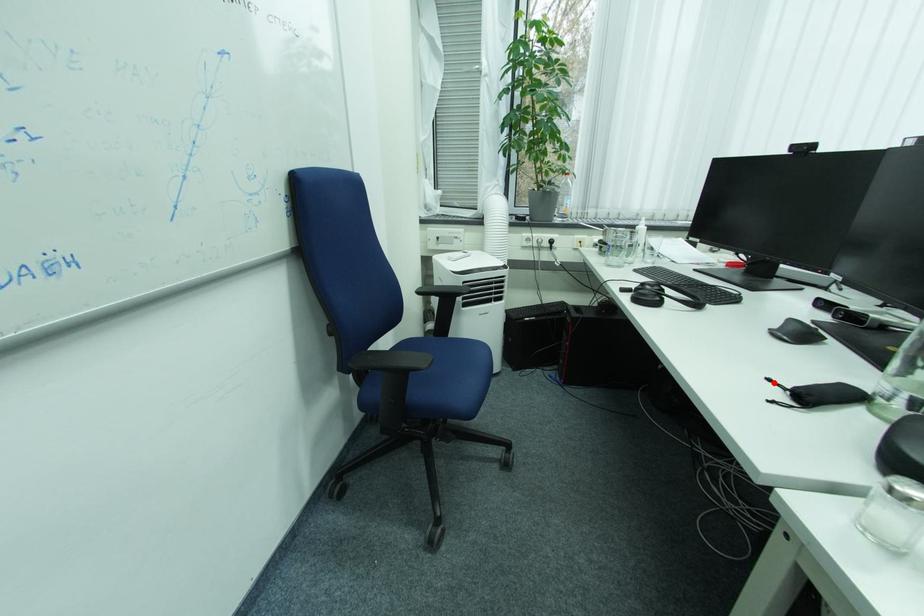
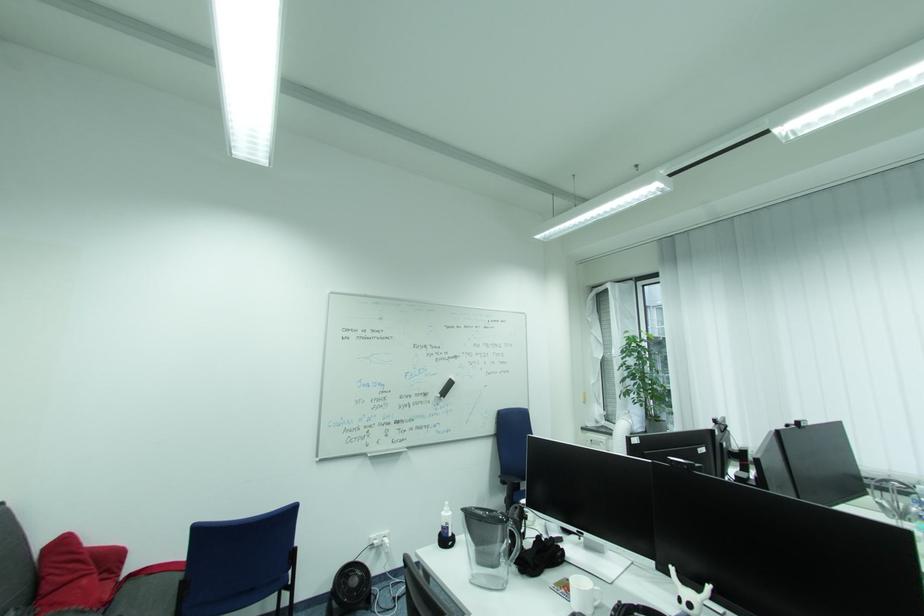
Question: I am providing you with two images of the same scene from different viewpoints. A red point is marked on the first image. Is the red point's position out of view in image 2?

Choices:
 (A) Yes
 (B) No

Answer: (A)